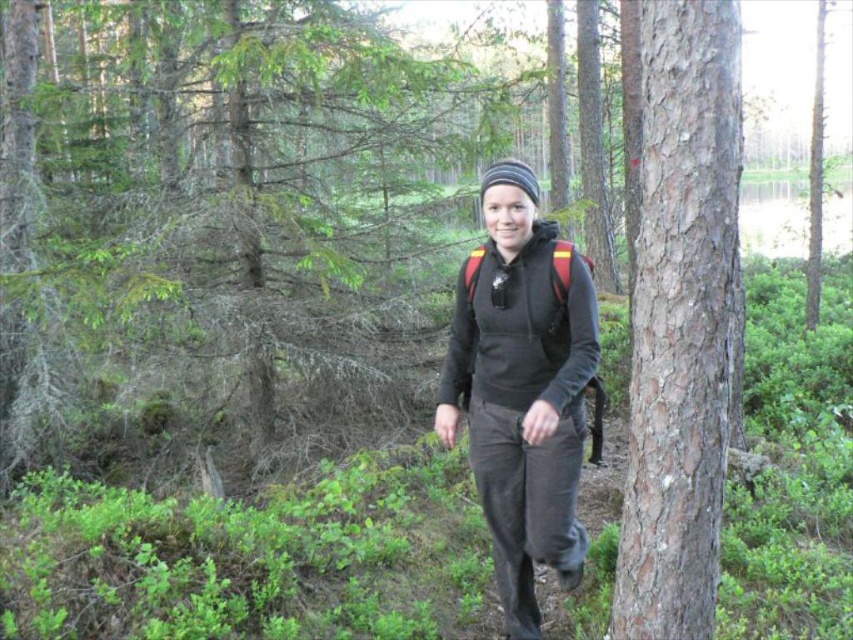
You are a hiker who wants to measure the thickness of the smooth brown bark at center and the matte black hoodie at center. Which object is thinner?

The smooth brown bark at center is thinner than the matte black hoodie at center.

You are a hiker who has just arrived at the forest area shown in the image. You need to locate a specific landmark marked by smooth brown bark at center. According to the coordinates provided, where exactly should you look to find this landmark?

The smooth brown bark at center is located at coordinates point (682, 321).